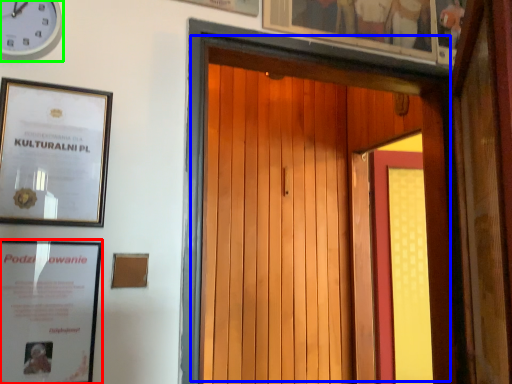
Question: Which object is positioned farthest from picture frame (highlighted by a red box)? Select from door (highlighted by a blue box) and clock (highlighted by a green box).

Choices:
 (A) door
 (B) clock

Answer: (B)